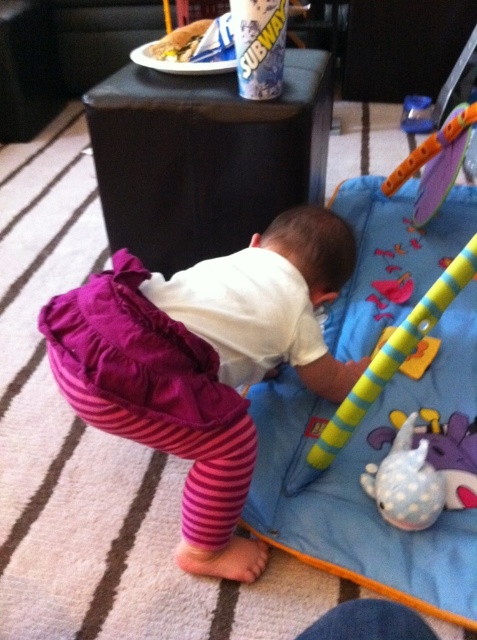
Is blue soft play mat at center smaller than pink fabric pants at center?

Incorrect, blue soft play mat at center is not smaller in size than pink fabric pants at center.

Does blue soft play mat at center lie behind pink fabric pants at center?

Yes.

I want to click on blue soft play mat at center, so click(377, 461).

The height and width of the screenshot is (640, 477). In order to click on blue soft play mat at center in this screenshot , I will do `click(377, 461)`.

Is blue soft play mat at center thinner than white dotted fabric toy at lower right?

Incorrect, blue soft play mat at center's width is not less than white dotted fabric toy at lower right's.

You are a GUI agent. You are given a task and a screenshot of the screen. Output one action in this format:
    pyautogui.click(x=<x>, y=<y>)
    Task: Click on the blue soft play mat at center
    This screenshot has width=477, height=640.
    Given the screenshot: What is the action you would take?
    pyautogui.click(x=377, y=461)

Which is above, pink fabric pants at center or white dotted fabric toy at lower right?

pink fabric pants at center is higher up.

Which is more to the right, pink fabric pants at center or white dotted fabric toy at lower right?

white dotted fabric toy at lower right is more to the right.

This screenshot has height=640, width=477. What are the coordinates of `pink fabric pants at center` in the screenshot? It's located at (206, 364).